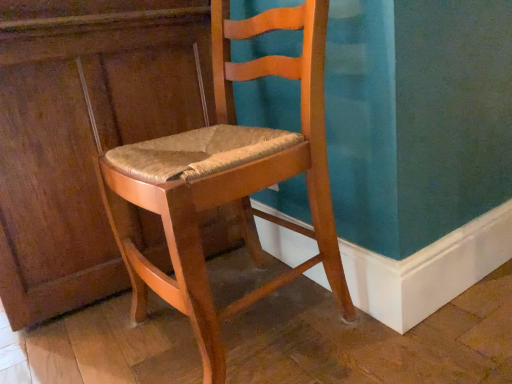
Question: Would you say matte wood chair at center is inside or outside matte wood dresser at left?

Choices:
 (A) outside
 (B) inside

Answer: (A)

Question: Is matte wood chair at center bigger or smaller than matte wood dresser at left?

Choices:
 (A) big
 (B) small

Answer: (B)

Question: Is matte wood chair at center wider or thinner than matte wood dresser at left?

Choices:
 (A) thin
 (B) wide

Answer: (A)

Question: In the image, is matte wood dresser at left positioned in front of or behind matte wood chair at center?

Choices:
 (A) behind
 (B) front

Answer: (A)

Question: From a real-world perspective, relative to matte wood chair at center, is matte wood dresser at left vertically above or below?

Choices:
 (A) above
 (B) below

Answer: (A)

Question: Is point (153, 243) positioned closer to the camera than point (240, 187)?

Choices:
 (A) closer
 (B) farther

Answer: (B)

Question: Is matte wood dresser at left situated inside matte wood chair at center or outside?

Choices:
 (A) inside
 (B) outside

Answer: (B)